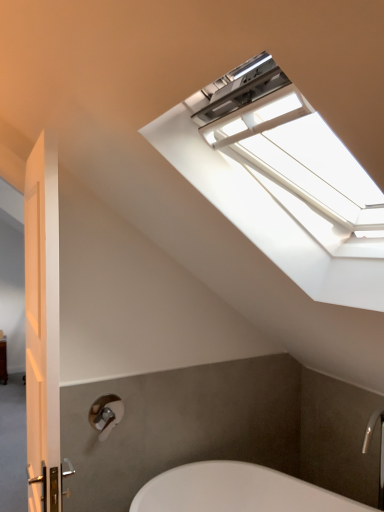
Question: Considering the positions of matte silver shower at lower left and silver metallic faucet at lower right in the image, is matte silver shower at lower left wider or thinner than silver metallic faucet at lower right?

Choices:
 (A) thin
 (B) wide

Answer: (A)

Question: From their relative heights in the image, would you say matte silver shower at lower left is taller or shorter than silver metallic faucet at lower right?

Choices:
 (A) tall
 (B) short

Answer: (B)

Question: Which is farther from the white plastic window at upper center?

Choices:
 (A) white glossy door at left
 (B) silver metallic faucet at lower right
 (C) matte silver shower at lower left

Answer: (B)

Question: Estimate the real-world distances between objects in this image. Which object is closer to the matte silver shower at lower left?

Choices:
 (A) white glossy door at left
 (B) white plastic window at upper center
 (C) silver metallic faucet at lower right

Answer: (A)